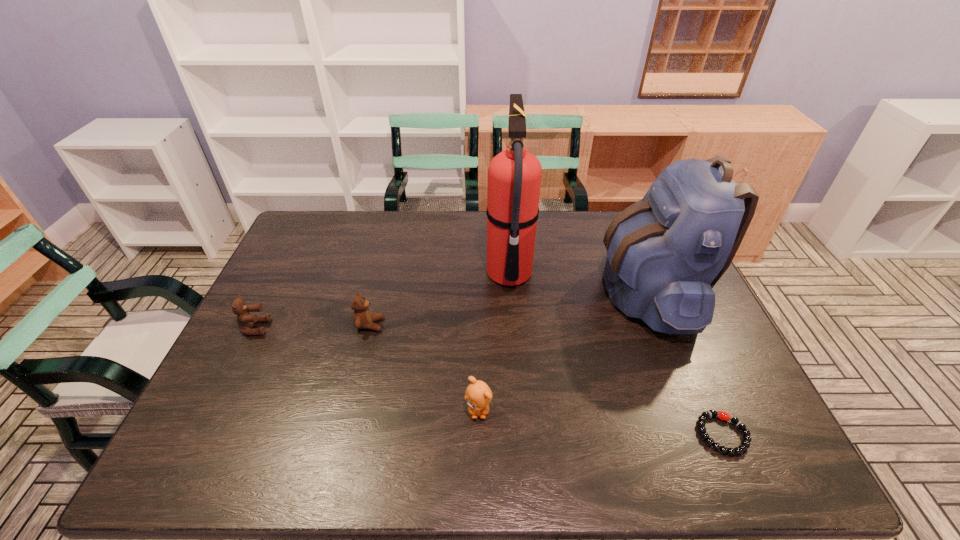
Where is `fire extinguisher`? fire extinguisher is located at coordinates (514, 176).

Find the location of a particular element. backpack is located at coordinates (665, 253).

The image size is (960, 540). I want to click on the second object from left to right, so click(x=362, y=317).

Locate an element on the screen. Image resolution: width=960 pixels, height=540 pixels. the leftmost teddy bear is located at coordinates (245, 320).

I want to click on the nearest teddy bear, so click(478, 395).

Locate an element on the screen. This screenshot has width=960, height=540. bracelet is located at coordinates (724, 416).

In order to click on vacant area situated at the nozzle of the fire extinguisher in this screenshot , I will do `click(388, 274)`.

Where is `vacant space located at the nozzle of the fire extinguisher`? The height and width of the screenshot is (540, 960). vacant space located at the nozzle of the fire extinguisher is located at coordinates (425, 274).

The image size is (960, 540). Identify the location of free spot located at the nozzle of the fire extinguisher. (369, 274).

At what (x,y) coordinates should I click in order to perform the action: click on vacant space situated 0.110m at the front pocket of the second tallest object. Please return your answer as a coordinate pair (x, y). Image resolution: width=960 pixels, height=540 pixels. Looking at the image, I should click on (564, 291).